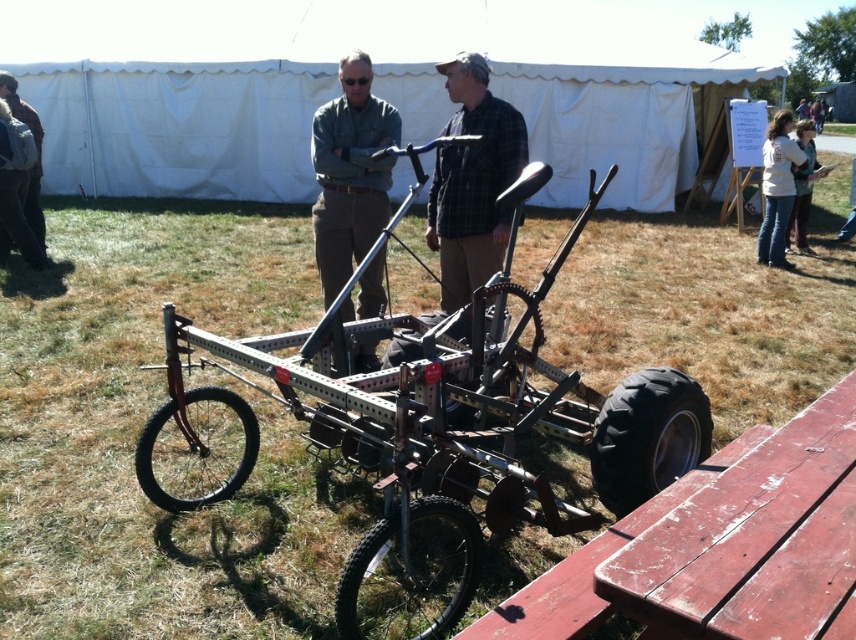
Question: Considering the real-world distances, which object is farthest from the white cotton shirt at upper right?

Choices:
 (A) dark brown leather jacket at upper left
 (B) metallic frame tricycle at center

Answer: (A)

Question: Which of the following is the farthest from the observer?

Choices:
 (A) matte black bicycle at center
 (B) white cotton shirt at right
 (C) white cotton shirt at upper right

Answer: (B)

Question: Which of the following is the farthest from the observer?

Choices:
 (A) (806, 216)
 (B) (437, 241)
 (C) (30, 177)
 (D) (403, 492)

Answer: (A)

Question: Can you confirm if matte black bicycle at center is positioned above plaid fabric shirt at center?

Choices:
 (A) yes
 (B) no

Answer: (B)

Question: Does metallic frame tricycle at center have a smaller size compared to dark brown leather jacket at upper left?

Choices:
 (A) no
 (B) yes

Answer: (A)

Question: Can you confirm if white fabric tent at upper center is smaller than dark brown leather jacket at upper left?

Choices:
 (A) yes
 (B) no

Answer: (B)